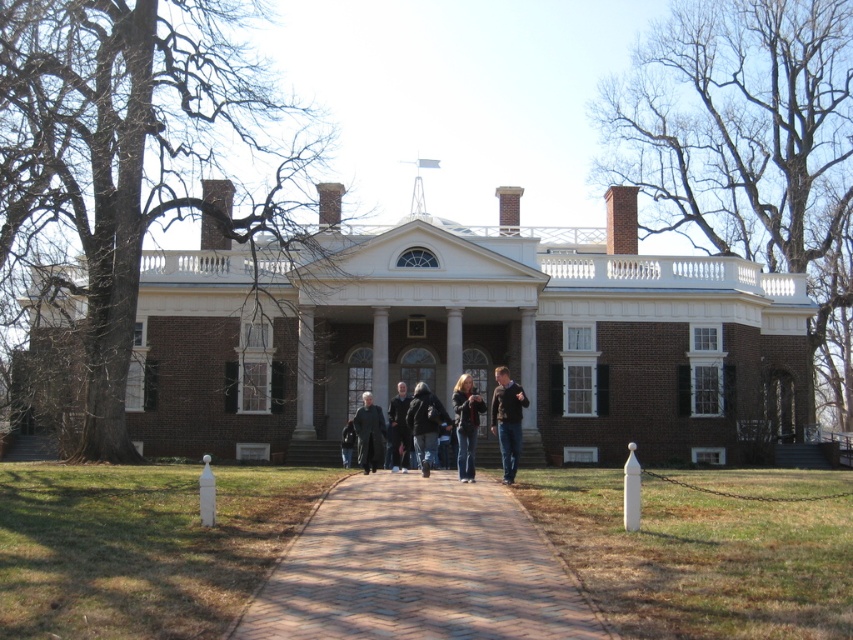
Consider the image. You are a delivery person approaching the mansion and need to park your vehicle. The parking spot is located near the brown brick building at center. However, there is a white glossy pillar at center in the way. Can you drive around the pillar to reach the parking spot?

The brown brick building at center is larger in size than the white glossy pillar at center, so the pillar is smaller and likely easier to maneuver around to reach the parking spot near the building.

You are a delivery person standing at the edge of the lawn near the chainlink fence. You need to deliver a package to the brown brick building at center. However, you notice a denim jacket at center lying on the ground. Can you safely walk straight towards the building without stepping on the jacket?

The brown brick building at center and denim jacket at center are 21.67 meters apart. Since the jacket is directly in the path to the building, you would have to step over or around it. However, the distance is quite large, so you can walk around the jacket to reach the building safely without stepping on it.